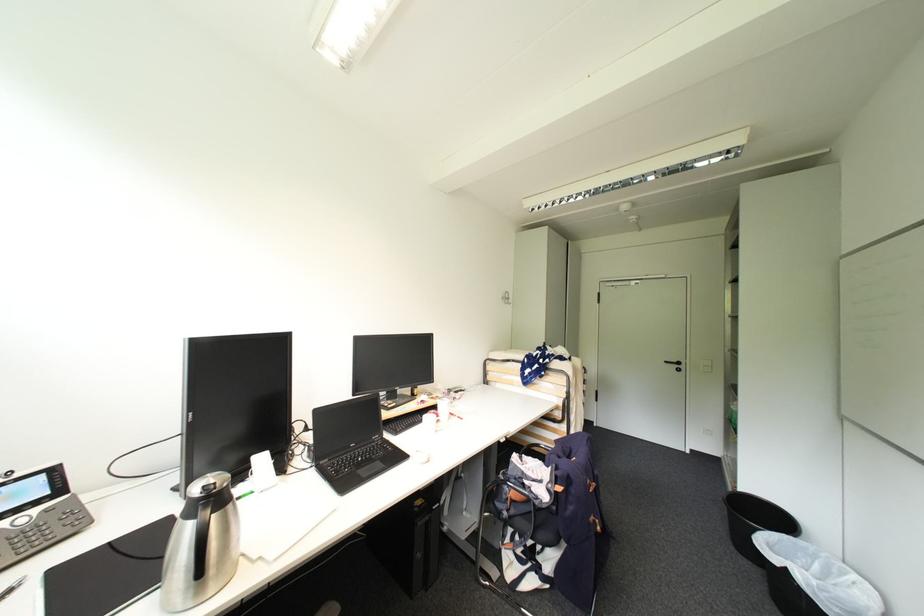
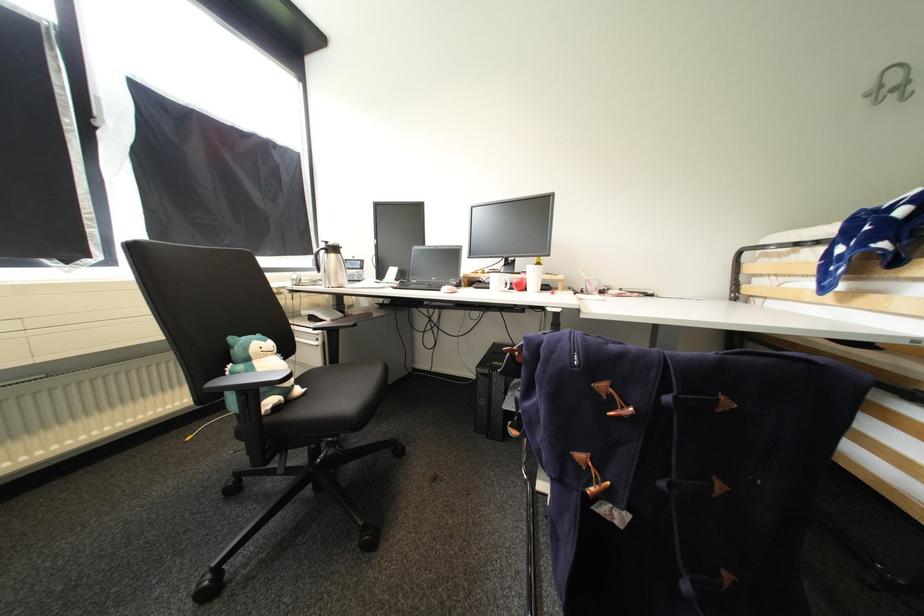
Locate, in the second image, the point that corresponds to (x=515, y=300) in the first image.

(912, 84)